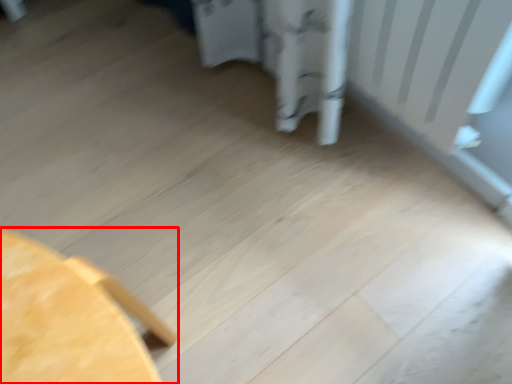
Question: In this image, where is furniture (annotated by the red box) located relative to radiator?

Choices:
 (A) right
 (B) left

Answer: (B)